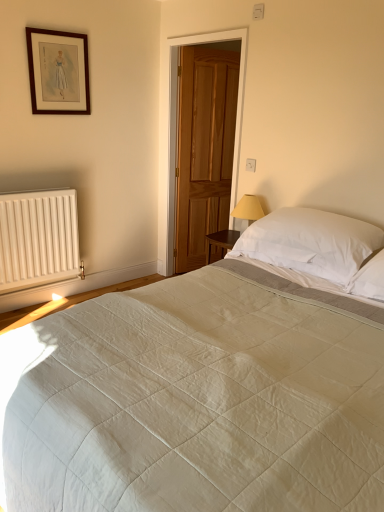
Question: From the image's perspective, is glossy wood door at center located beneath white quilted bed at center?

Choices:
 (A) no
 (B) yes

Answer: (A)

Question: Can we say glossy wood door at center lies outside white quilted bed at center?

Choices:
 (A) yes
 (B) no

Answer: (A)

Question: Is glossy wood door at center positioned far away from white quilted bed at center?

Choices:
 (A) no
 (B) yes

Answer: (B)

Question: From a real-world perspective, is glossy wood door at center under white quilted bed at center?

Choices:
 (A) yes
 (B) no

Answer: (B)

Question: Can you confirm if glossy wood door at center is positioned to the left of white quilted bed at center?

Choices:
 (A) no
 (B) yes

Answer: (B)

Question: Is white quilted bed at center surrounded by glossy wood door at center?

Choices:
 (A) yes
 (B) no

Answer: (B)

Question: Would you consider wooden picture frame at upper left to be distant from white soft pillow at upper right?

Choices:
 (A) no
 (B) yes

Answer: (B)

Question: Is wooden picture frame at upper left further to the viewer compared to white soft pillow at upper right?

Choices:
 (A) no
 (B) yes

Answer: (B)

Question: Is wooden picture frame at upper left in front of white soft pillow at upper right?

Choices:
 (A) no
 (B) yes

Answer: (A)

Question: Does wooden picture frame at upper left have a greater width compared to white soft pillow at upper right?

Choices:
 (A) no
 (B) yes

Answer: (A)

Question: Can you confirm if wooden picture frame at upper left is thinner than white soft pillow at upper right?

Choices:
 (A) yes
 (B) no

Answer: (A)

Question: From a real-world perspective, is wooden picture frame at upper left physically below white soft pillow at upper right?

Choices:
 (A) yes
 (B) no

Answer: (B)

Question: Could you tell me if glossy wood door at center is turned towards white matte radiator at lower left?

Choices:
 (A) yes
 (B) no

Answer: (B)